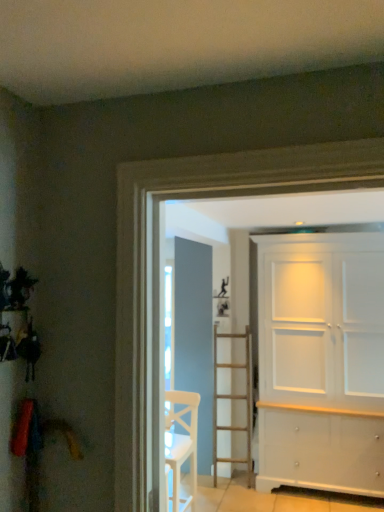
The width and height of the screenshot is (384, 512). What do you see at coordinates (180, 444) in the screenshot?
I see `white wooden chair at center` at bounding box center [180, 444].

This screenshot has width=384, height=512. I want to click on white wooden chair at center, so tap(180, 444).

What do you see at coordinates (321, 362) in the screenshot?
I see `white painted wood cabinet at right` at bounding box center [321, 362].

Locate an element on the screen. This screenshot has height=512, width=384. white painted wood cabinet at right is located at coordinates (321, 362).

This screenshot has height=512, width=384. I want to click on white wooden chair at center, so click(180, 444).

Which is more to the right, white wooden chair at center or white painted wood cabinet at right?

white painted wood cabinet at right is more to the right.

Considering their positions, is white wooden chair at center located in front of or behind white painted wood cabinet at right?

white wooden chair at center is positioned closer to the viewer than white painted wood cabinet at right.

Is point (191, 481) farther from camera compared to point (265, 250)?

No.

From the image's perspective, is white wooden chair at center positioned above or below white painted wood cabinet at right?

Based on their image positions, white wooden chair at center is located beneath white painted wood cabinet at right.

From a real-world perspective, is white wooden chair at center over white painted wood cabinet at right?

No, from a real-world perspective, white wooden chair at center is not on top of white painted wood cabinet at right.

Which of these two, white wooden chair at center or white painted wood cabinet at right, is wider?

Wider between the two is white painted wood cabinet at right.

Can you confirm if white wooden chair at center is shorter than white painted wood cabinet at right?

Indeed, white wooden chair at center has a lesser height compared to white painted wood cabinet at right.

Can you confirm if white wooden chair at center is smaller than white painted wood cabinet at right?

Correct, white wooden chair at center occupies less space than white painted wood cabinet at right.

Is white wooden chair at center inside the boundaries of white painted wood cabinet at right, or outside?

white wooden chair at center is located beyond the bounds of white painted wood cabinet at right.

Is white wooden chair at center directly adjacent to white painted wood cabinet at right?

No.

Could you tell me if white wooden chair at center is turned towards white painted wood cabinet at right?

No.

Measure the distance between white wooden chair at center and white painted wood cabinet at right.

They are 1.16 meters apart.

Locate an element on the screen. chair in front of the white painted wood cabinet at right is located at coordinates (180, 444).

Based on the photo, which object is positioned more to the left, white painted wood cabinet at right or white wooden chair at center?

white wooden chair at center.

Is the depth of white painted wood cabinet at right less than that of white wooden chair at center?

No.

Does point (260, 302) come farther from viewer compared to point (171, 394)?

Yes, it is.

From the image's perspective, which is below, white painted wood cabinet at right or white wooden chair at center?

white wooden chair at center, from the image's perspective.

From a real-world perspective, which object stands above the other?

In real-world perspective, white painted wood cabinet at right is above.

Which object is thinner, white painted wood cabinet at right or white wooden chair at center?

With smaller width is white wooden chair at center.

Is white painted wood cabinet at right taller or shorter than white wooden chair at center?

Considering their sizes, white painted wood cabinet at right has more height than white wooden chair at center.

Considering the sizes of objects white painted wood cabinet at right and white wooden chair at center in the image provided, who is bigger, white painted wood cabinet at right or white wooden chair at center?

Bigger between the two is white painted wood cabinet at right.

Is white painted wood cabinet at right not within white wooden chair at center?

That's correct, white painted wood cabinet at right is outside of white wooden chair at center.

Is white painted wood cabinet at right directly adjacent to white wooden chair at center?

white painted wood cabinet at right and white wooden chair at center are clearly separated.

Is white painted wood cabinet at right positioned with its back to white wooden chair at center?

white painted wood cabinet at right does not have its back to white wooden chair at center.

Image resolution: width=384 pixels, height=512 pixels. Identify the location of chair below the white painted wood cabinet at right (from a real-world perspective). (180, 444).

At what (x,y) coordinates should I click in order to perform the action: click on chair that is below the white painted wood cabinet at right (from the image's perspective). Please return your answer as a coordinate pair (x, y). Image resolution: width=384 pixels, height=512 pixels. Looking at the image, I should click on (180, 444).

What are the coordinates of `door positioned vertically above the white wooden chair at center (from a real-world perspective)` in the screenshot? It's located at (321, 362).